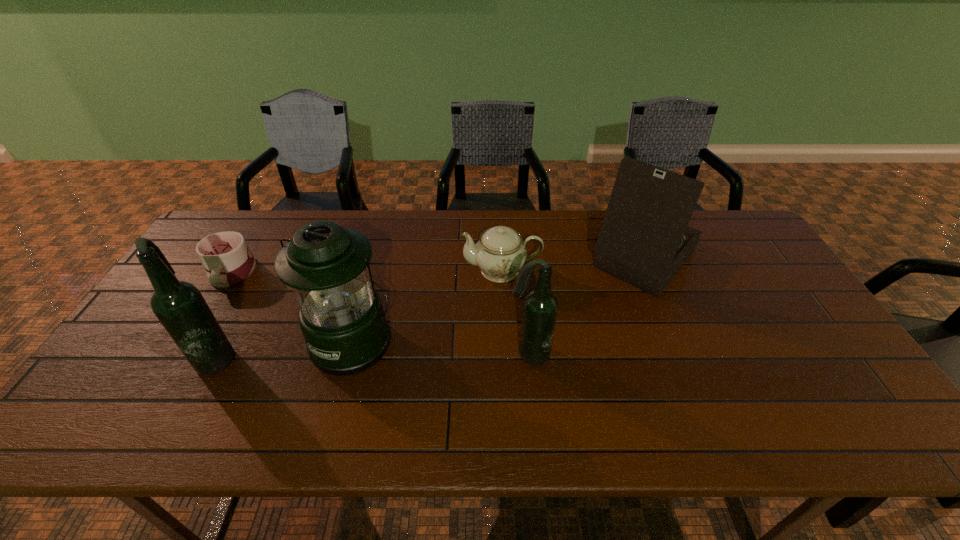
Find the location of a particular element. vacant region between the lantern and the left beer bottle is located at coordinates (286, 349).

The height and width of the screenshot is (540, 960). I want to click on object identified as the third closest to the phonograph record, so click(341, 316).

I want to click on object that stands as the fourth closest to the rightmost object, so click(180, 307).

The width and height of the screenshot is (960, 540). I want to click on vacant space that satisfies the following two spatial constraints: 1. at the spout of the chinaware; 2. on the side with the handle of the mug, so click(502, 274).

What are the coordinates of `free space that satisfies the following two spatial constraints: 1. on the side with the handle of the shortest object; 2. on the left side of the shorter beer bottle` in the screenshot? It's located at (183, 354).

Locate an element on the screen. vacant space that satisfies the following two spatial constraints: 1. on the side with the handle of the shorter beer bottle; 2. on the left side of the shortest object is located at coordinates (183, 354).

Locate an element on the screen. vacant space that satisfies the following two spatial constraints: 1. at the spout of the chinaware; 2. on the left side of the right beer bottle is located at coordinates (506, 354).

The height and width of the screenshot is (540, 960). I want to click on vacant point that satisfies the following two spatial constraints: 1. at the spout of the chinaware; 2. on the left side of the fourth tallest object, so click(x=506, y=354).

The width and height of the screenshot is (960, 540). I want to click on vacant area that satisfies the following two spatial constraints: 1. on the back side of the left beer bottle; 2. on the right side of the fourth tallest object, so click(x=219, y=354).

Locate an element on the screen. free space that satisfies the following two spatial constraints: 1. on the front side of the phonograph record; 2. at the spout of the fifth tallest object is located at coordinates (649, 270).